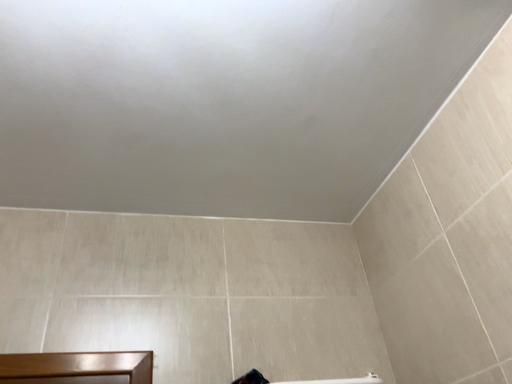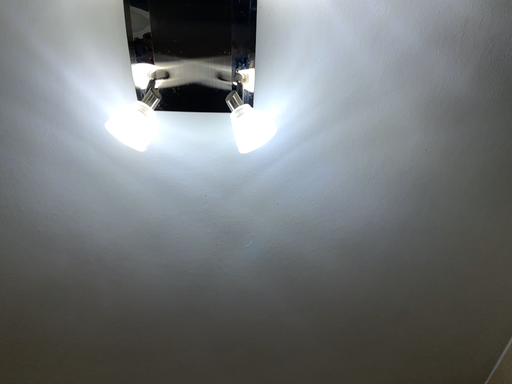
Question: Which way did the camera rotate in the video?

Choices:
 (A) rotated right
 (B) rotated left

Answer: (B)